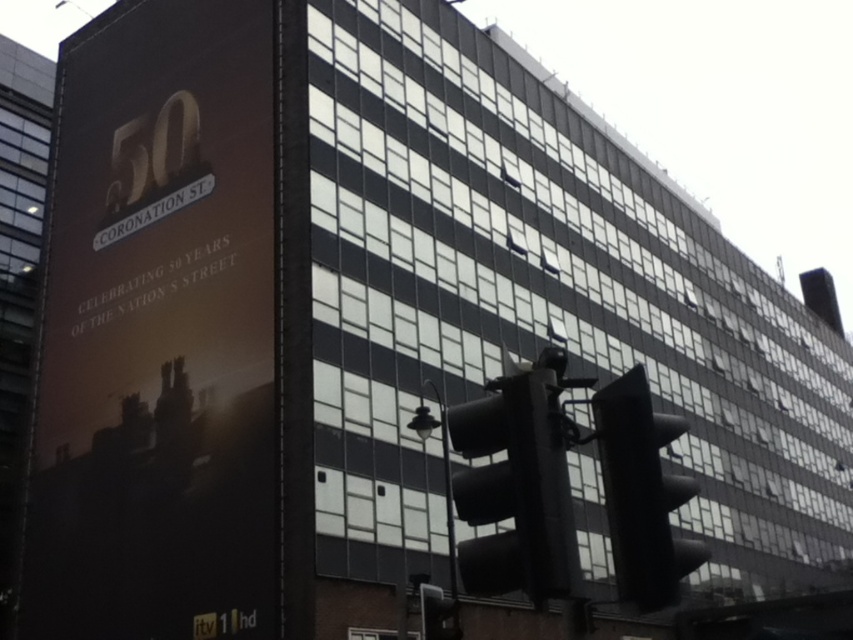
You are a pedestrian standing at the corner of the street. You see a black matte traffic light at lower right and a black plastic pole at lower center. Which object is positioned higher relative to the other?

The black matte traffic light at lower right is above the black plastic pole at lower center, so it is positioned higher.

You are standing on the sidewalk in front of the tall building. You notice a black plastic pole at lower center and a black matte traffic light at lower right. Which object is positioned more to the east if the building faces north?

The black matte traffic light at lower right is to the right of the black plastic pole at lower center. Since the building faces north, the right side would correspond to the east direction. Therefore, the black matte traffic light at lower right is positioned more to the east.